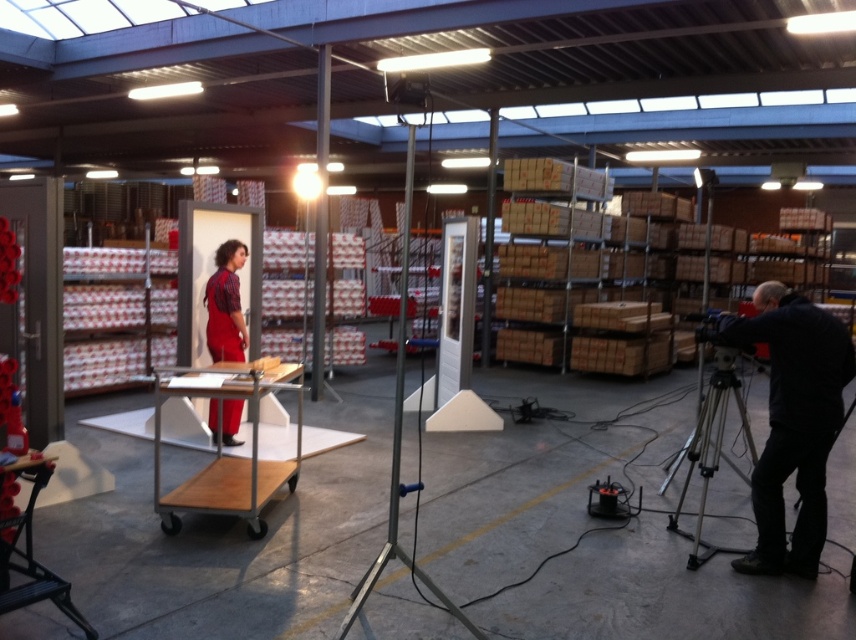
Is silver metallic tripod at lower right shorter than matte red jumpsuit at center?

In fact, silver metallic tripod at lower right may be taller than matte red jumpsuit at center.

Does silver metallic tripod at lower right appear over matte red jumpsuit at center?

No, silver metallic tripod at lower right is not above matte red jumpsuit at center.

Where is `silver metallic tripod at lower right`? silver metallic tripod at lower right is located at coordinates (710, 451).

Consider the image. Which is above, dark blue jacket at right or silver metallic tripod at lower right?

dark blue jacket at right is above.

In the scene shown: Who is taller, dark blue jacket at right or silver metallic tripod at lower right?

dark blue jacket at right is taller.

Identify the location of dark blue jacket at right. The width and height of the screenshot is (856, 640). (792, 420).

Identify the location of dark blue jacket at right. Image resolution: width=856 pixels, height=640 pixels. (792, 420).

Is wooden trolley at center taller than matte red jumpsuit at center?

In fact, wooden trolley at center may be shorter than matte red jumpsuit at center.

Between wooden trolley at center and matte red jumpsuit at center, which one has more height?

matte red jumpsuit at center

Who is more distant from viewer, (259, 401) or (241, 358)?

The point (241, 358) is behind.

This screenshot has width=856, height=640. I want to click on wooden trolley at center, so click(230, 456).